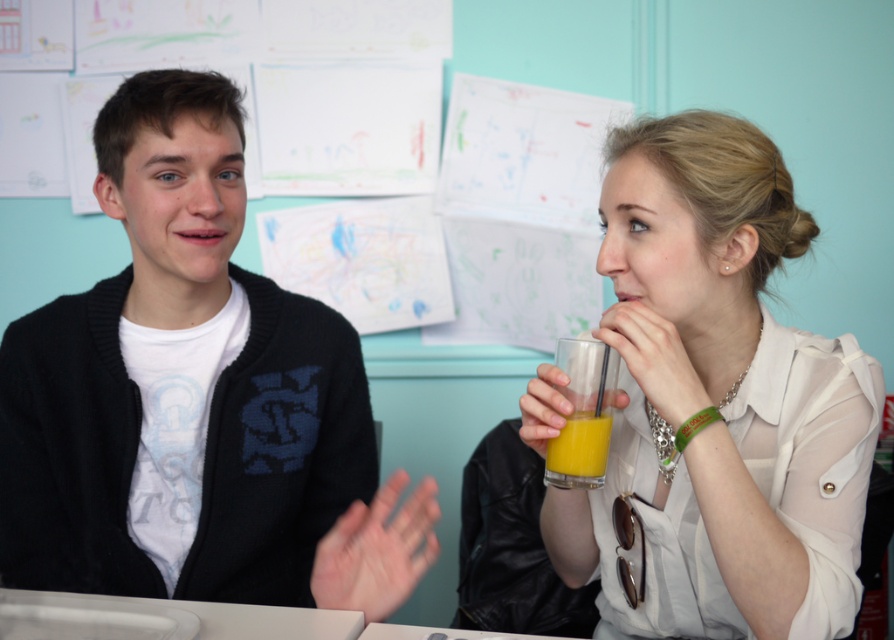
Question: Is white glossy shirt at upper right bigger than orange liquid glass at center?

Choices:
 (A) no
 (B) yes

Answer: (B)

Question: Does white glossy shirt at upper right lie behind orange liquid glass at center?

Choices:
 (A) yes
 (B) no

Answer: (B)

Question: Estimate the real-world distances between objects in this image. Which object is closer to the orange liquid glass at center?

Choices:
 (A) translucent glass of orange juice at center
 (B) white glossy table at center
 (C) white glossy shirt at upper right

Answer: (A)

Question: Among these objects, which one is farthest from the camera?

Choices:
 (A) white glossy shirt at upper right
 (B) orange liquid glass at center

Answer: (B)

Question: Is orange liquid glass at center thinner than translucent glass of orange juice at center?

Choices:
 (A) yes
 (B) no

Answer: (B)

Question: Among these points, which one is farthest from the camera?

Choices:
 (A) (817, 525)
 (B) (566, 360)
 (C) (595, 460)
 (D) (133, 611)

Answer: (B)